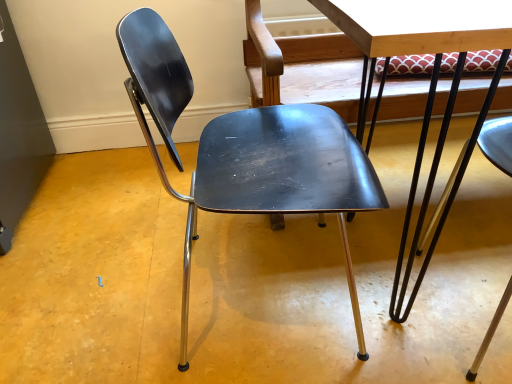
What are the coordinates of `vacant area situated below matte black chair at center (from a real-world perspective)` in the screenshot? It's located at (256, 284).